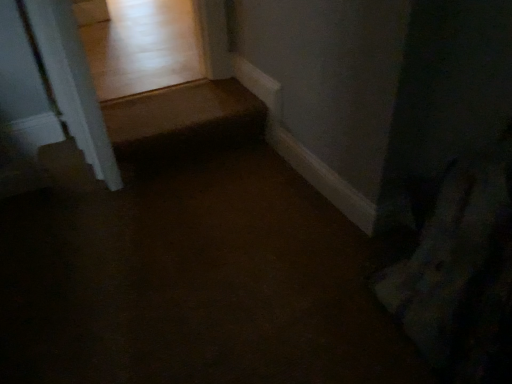
The image size is (512, 384). Describe the element at coordinates (73, 84) in the screenshot. I see `white glossy door frame at upper left` at that location.

What are the coordinates of `white glossy door frame at upper left` in the screenshot? It's located at (73, 84).

Measure the distance between point (353, 302) and camera.

4.39 feet.

Describe the element at coordinates (192, 280) in the screenshot. The height and width of the screenshot is (384, 512). I see `brown carpet at center` at that location.

This screenshot has height=384, width=512. I want to click on brown carpet at center, so click(192, 280).

In order to click on white glossy door frame at upper left in this screenshot , I will do `click(73, 84)`.

Between white glossy door frame at upper left and brown carpet at center, which one appears on the right side from the viewer's perspective?

brown carpet at center is more to the right.

Is the position of white glossy door frame at upper left less distant than that of brown carpet at center?

No, it is not.

Does point (91, 126) appear closer or farther from the camera than point (167, 199)?

Point (91, 126).

Looking at this image, from the image's perspective, which one is positioned lower, white glossy door frame at upper left or brown carpet at center?

brown carpet at center, from the image's perspective.

From a real-world perspective, is white glossy door frame at upper left physically above brown carpet at center?

Correct, in the physical world, white glossy door frame at upper left is higher than brown carpet at center.

Which of these two, white glossy door frame at upper left or brown carpet at center, is wider?

brown carpet at center is wider.

Between white glossy door frame at upper left and brown carpet at center, which one has more height?

white glossy door frame at upper left.

Considering the sizes of objects white glossy door frame at upper left and brown carpet at center in the image provided, who is smaller, white glossy door frame at upper left or brown carpet at center?

Smaller between the two is white glossy door frame at upper left.

Is white glossy door frame at upper left situated inside brown carpet at center or outside?

white glossy door frame at upper left is located beyond the bounds of brown carpet at center.

Is the surface of white glossy door frame at upper left in direct contact with brown carpet at center?

white glossy door frame at upper left and brown carpet at center are clearly separated.

Is white glossy door frame at upper left oriented away from brown carpet at center?

No, white glossy door frame at upper left is not facing away from brown carpet at center.

What's the angular difference between white glossy door frame at upper left and brown carpet at center's facing directions?

They differ by 95.8 degrees in their facing directions.

Where is `path that is in front of the white glossy door frame at upper left`? path that is in front of the white glossy door frame at upper left is located at coordinates (192, 280).

Considering the relative positions of brown carpet at center and white glossy door frame at upper left in the image provided, is brown carpet at center to the right of white glossy door frame at upper left from the viewer's perspective?

Indeed, brown carpet at center is positioned on the right side of white glossy door frame at upper left.

Is brown carpet at center further to the viewer compared to white glossy door frame at upper left?

No, the depth of brown carpet at center is less than that of white glossy door frame at upper left.

Is point (204, 200) less distant than point (36, 39)?

No, (204, 200) is behind (36, 39).

From the picture: From the image's perspective, is brown carpet at center beneath white glossy door frame at upper left?

Yes, from the image's perspective, brown carpet at center is beneath white glossy door frame at upper left.

From a real-world perspective, relative to white glossy door frame at upper left, is brown carpet at center vertically above or below?

From a real-world perspective, brown carpet at center is physically below white glossy door frame at upper left.

Which of these two, brown carpet at center or white glossy door frame at upper left, is wider?

Wider between the two is brown carpet at center.

Is brown carpet at center shorter than white glossy door frame at upper left?

Indeed, brown carpet at center has a lesser height compared to white glossy door frame at upper left.

In the scene shown: Which of these two, brown carpet at center or white glossy door frame at upper left, is bigger?

With larger size is brown carpet at center.

Do you think brown carpet at center is within white glossy door frame at upper left, or outside of it?

The correct answer is: outside.

Is the surface of brown carpet at center in direct contact with white glossy door frame at upper left?

brown carpet at center is not next to white glossy door frame at upper left, and they're not touching.

Is brown carpet at center facing away from white glossy door frame at upper left?

No, brown carpet at center is not facing away from white glossy door frame at upper left.

How different are the orientations of brown carpet at center and white glossy door frame at upper left in degrees?

The facing directions of brown carpet at center and white glossy door frame at upper left are 95.8 degrees apart.

Locate an element on the screen. The width and height of the screenshot is (512, 384). pillar lying above the brown carpet at center (from the image's perspective) is located at coordinates (73, 84).

What are the coordinates of `path below the white glossy door frame at upper left (from a real-world perspective)` in the screenshot? It's located at (192, 280).

Locate an element on the screen. path on the right of white glossy door frame at upper left is located at coordinates (192, 280).